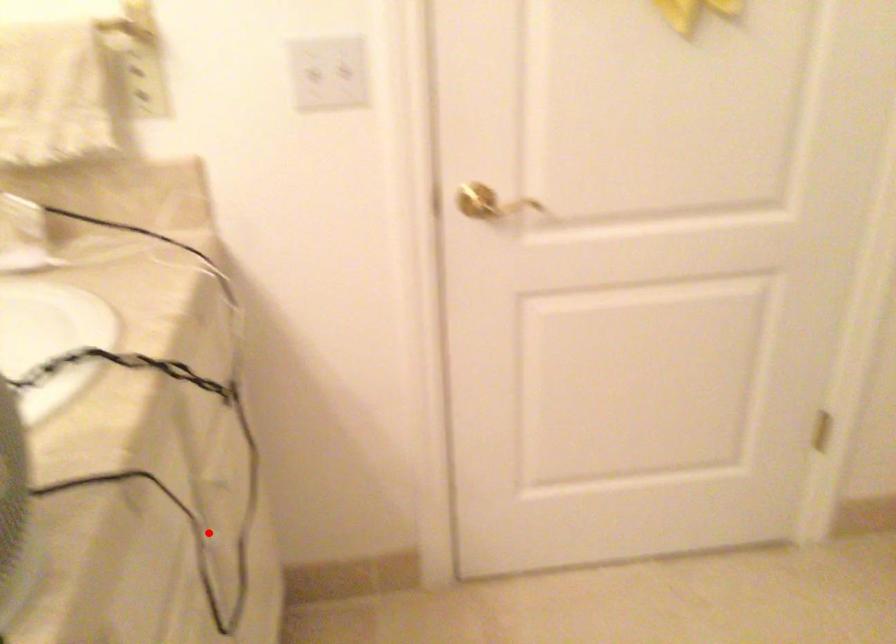
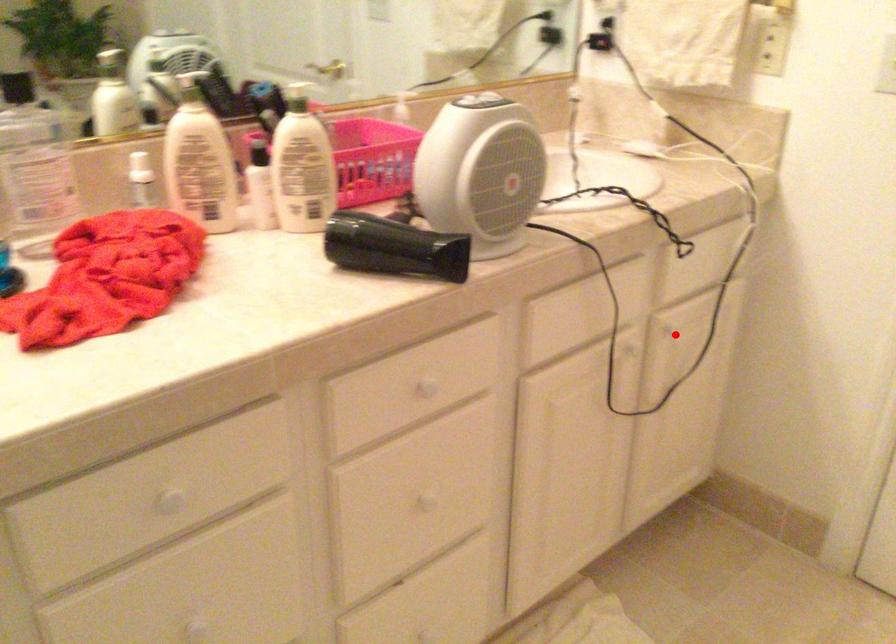
I am providing you with two images of the same scene from different viewpoints. A red point is marked on the first image and another point is marked on the second image. Do the highlighted points in image1 and image2 indicate the same real-world spot?

No